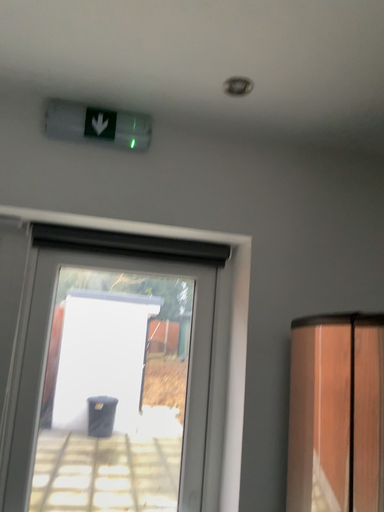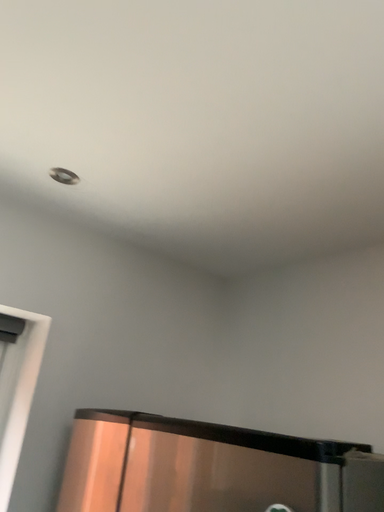
Question: How did the camera likely rotate when shooting the video?

Choices:
 (A) rotated right
 (B) rotated left

Answer: (A)